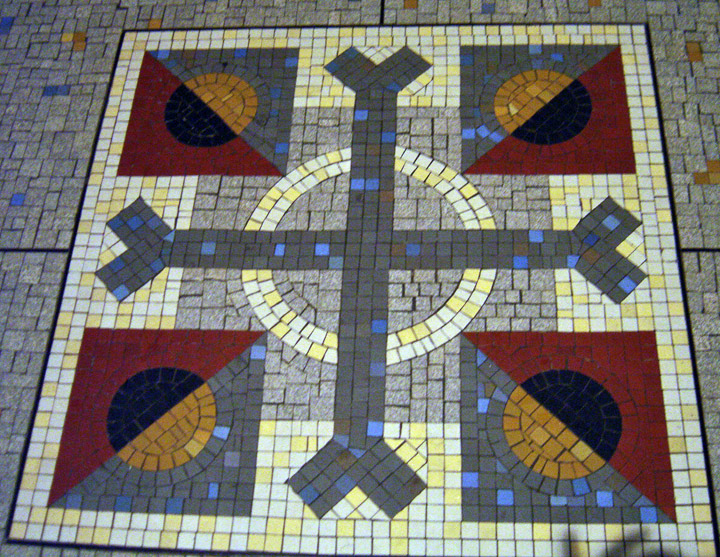
Image resolution: width=720 pixels, height=557 pixels. Identify the location of white and yellow pattern tile border. (444, 522).